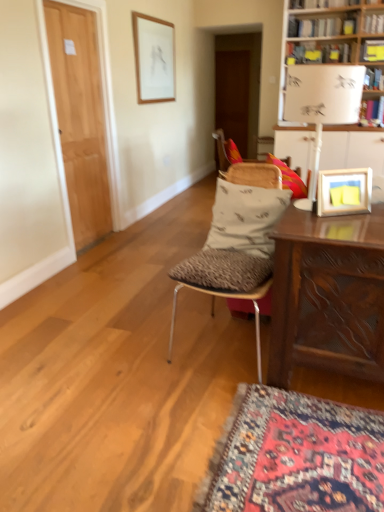
At what (x,y) coordinates should I click in order to perform the action: click on free point below light brown wood door at left, which is the 1th door in left-to-right order (from a real-world perspective). Please return your answer as a coordinate pair (x, y). Looking at the image, I should click on (96, 241).